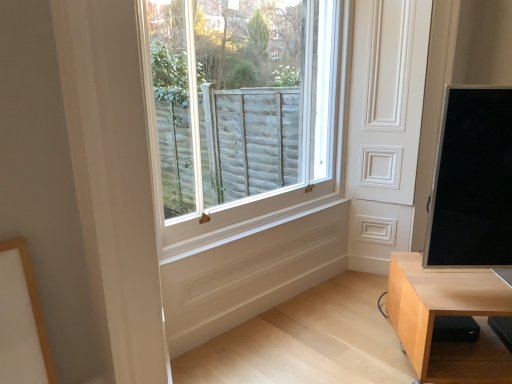
Question: Is point (458, 213) positioned closer to the camera than point (254, 125)?

Choices:
 (A) closer
 (B) farther

Answer: (A)

Question: In terms of width, does black glossy screen at right look wider or thinner when compared to white wooden window at center?

Choices:
 (A) thin
 (B) wide

Answer: (B)

Question: Based on their relative distances, which object is farther from the light wood table at lower right?

Choices:
 (A) white wooden window at center
 (B) black glossy screen at right

Answer: (A)

Question: Estimate the real-world distances between objects in this image. Which object is closer to the black glossy screen at right?

Choices:
 (A) light wood table at lower right
 (B) white wooden window at center

Answer: (A)